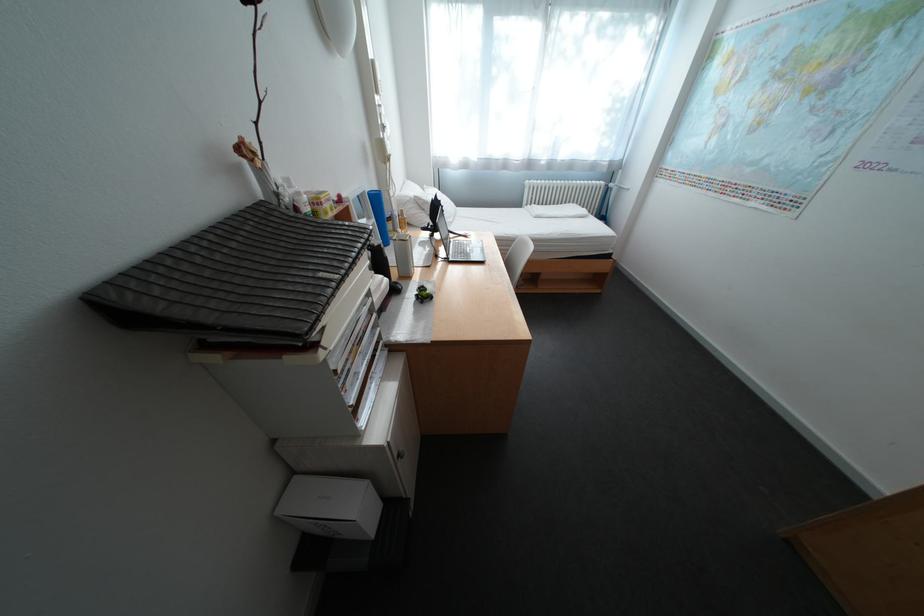
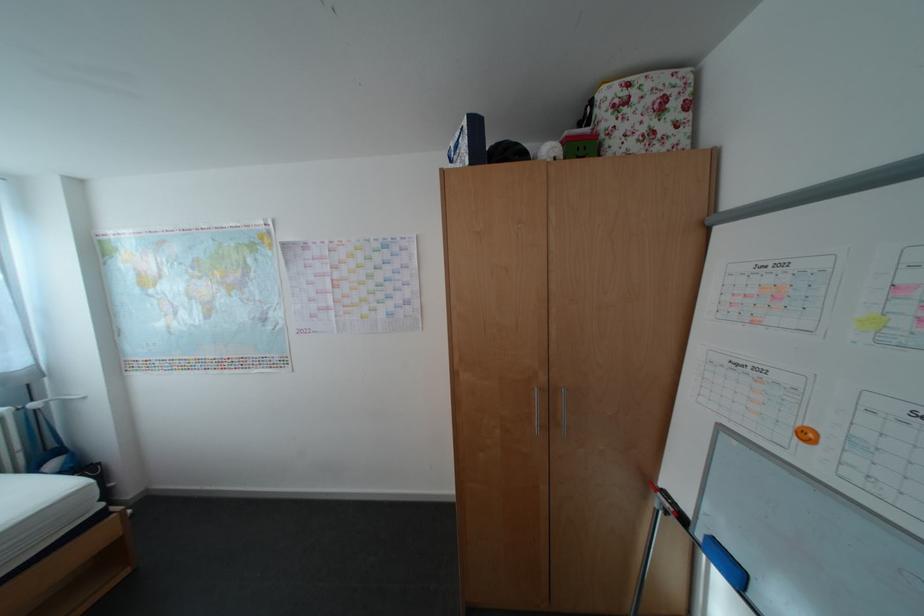
Question: How did the camera likely rotate?

Choices:
 (A) Left
 (B) Right
 (C) Up
 (D) Down

Answer: (B)